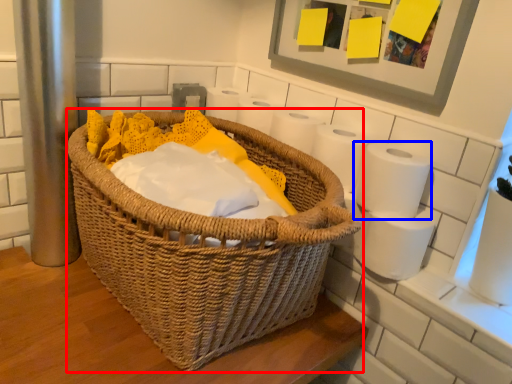
Question: Which object is further to the camera taking this photo, picnic basket (highlighted by a red box) or toilet paper (highlighted by a blue box)?

Choices:
 (A) picnic basket
 (B) toilet paper

Answer: (B)